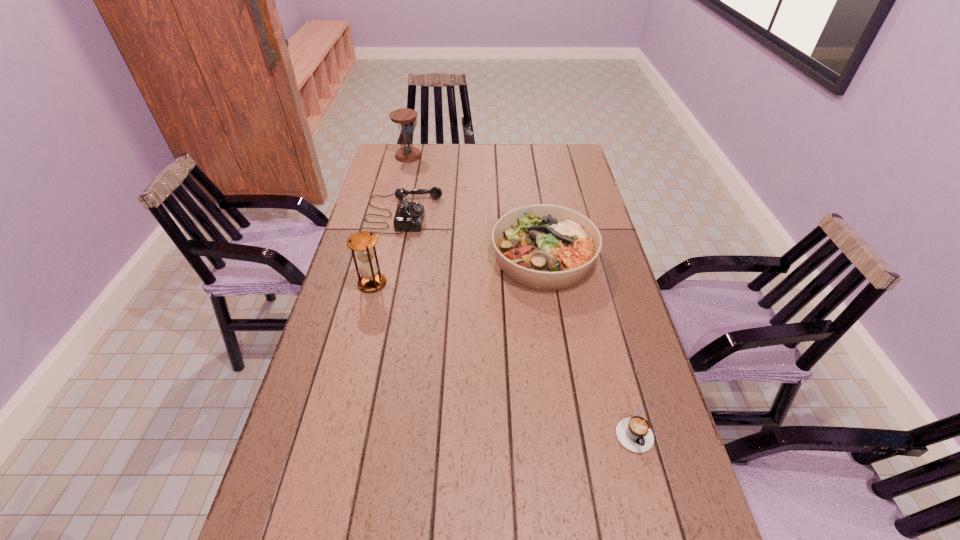
The image size is (960, 540). In order to click on blank space located 0.050m with the handle on the side of the nearest object in this screenshot , I will do `click(645, 477)`.

Image resolution: width=960 pixels, height=540 pixels. I want to click on object at the far edge, so click(x=403, y=117).

Locate an element on the screen. The height and width of the screenshot is (540, 960). telephone present at the left edge is located at coordinates (409, 216).

Image resolution: width=960 pixels, height=540 pixels. Find the location of `salad plate that is positioned at the right edge`. salad plate that is positioned at the right edge is located at coordinates (545, 247).

I want to click on cappuccino that is at the right edge, so click(x=634, y=433).

This screenshot has width=960, height=540. Find the location of `object present at the far left corner`. object present at the far left corner is located at coordinates (403, 117).

You are a GUI agent. You are given a task and a screenshot of the screen. Output one action in this format:
    pyautogui.click(x=<x>, y=<y>)
    Task: Click on the free space at the far edge of the desktop
    Image resolution: width=960 pixels, height=540 pixels.
    Given the screenshot: What is the action you would take?
    pyautogui.click(x=478, y=144)

The height and width of the screenshot is (540, 960). I want to click on free space at the left edge of the desktop, so click(x=295, y=461).

The width and height of the screenshot is (960, 540). Identify the location of free space at the right edge. (669, 497).

Locate an element on the screen. This screenshot has height=540, width=960. free space at the far right corner is located at coordinates (573, 167).